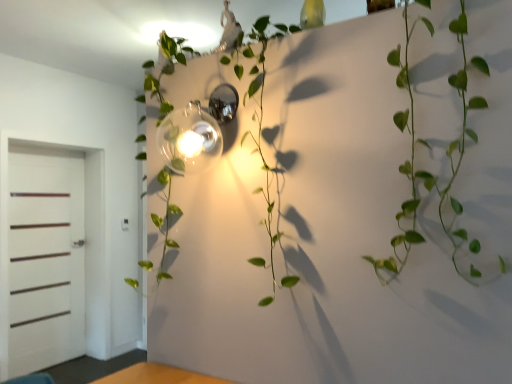
Question: From the image's perspective, is white matte door at left positioned above or below polished chrome sconce at center?

Choices:
 (A) above
 (B) below

Answer: (B)

Question: From their relative heights in the image, would you say white matte door at left is taller or shorter than polished chrome sconce at center?

Choices:
 (A) short
 (B) tall

Answer: (B)

Question: Based on their relative distances, which object is nearer to the green leafy vine at center?

Choices:
 (A) polished chrome sconce at center
 (B) green leafy vine at center
 (C) white matte door at left

Answer: (A)

Question: Which is nearer to the green leafy vine at center?

Choices:
 (A) white matte door at left
 (B) polished chrome sconce at center
 (C) green leafy vine at center

Answer: (C)